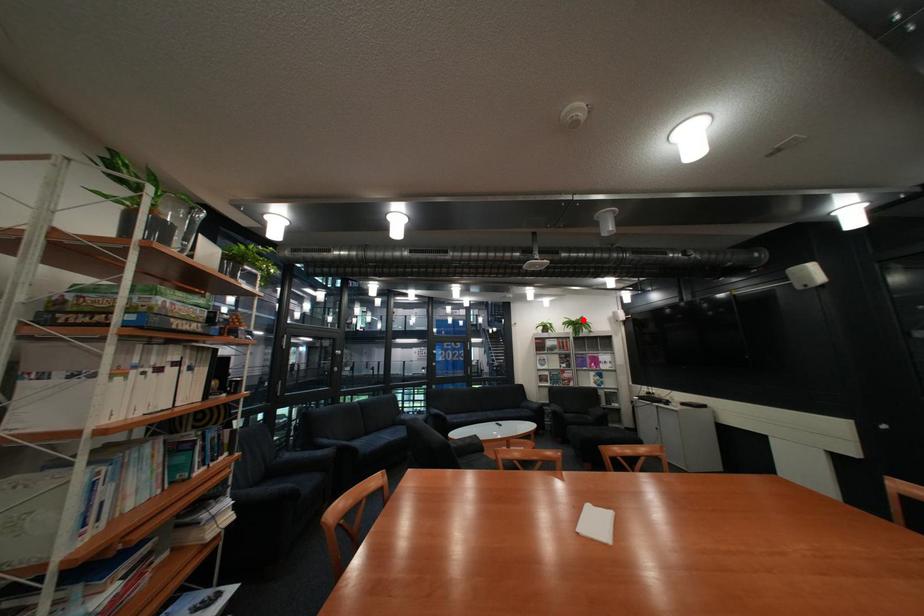
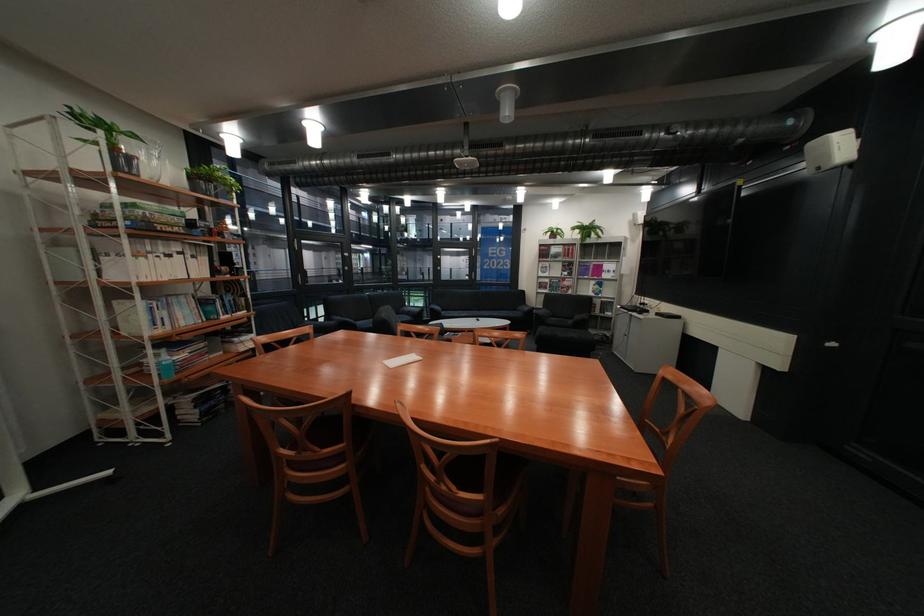
The point at the highlighted location is marked in the first image. Where is the corresponding point in the second image?

(594, 225)